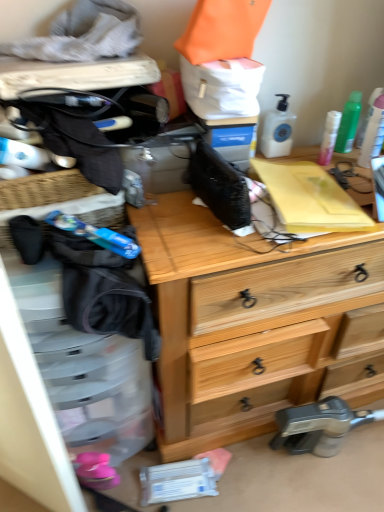
I want to click on vacant area that lies between white plastic pump bottle at upper right, the first toiletry from the left, and green matte spray can at upper right, the 3th toiletry from the left, so click(x=307, y=153).